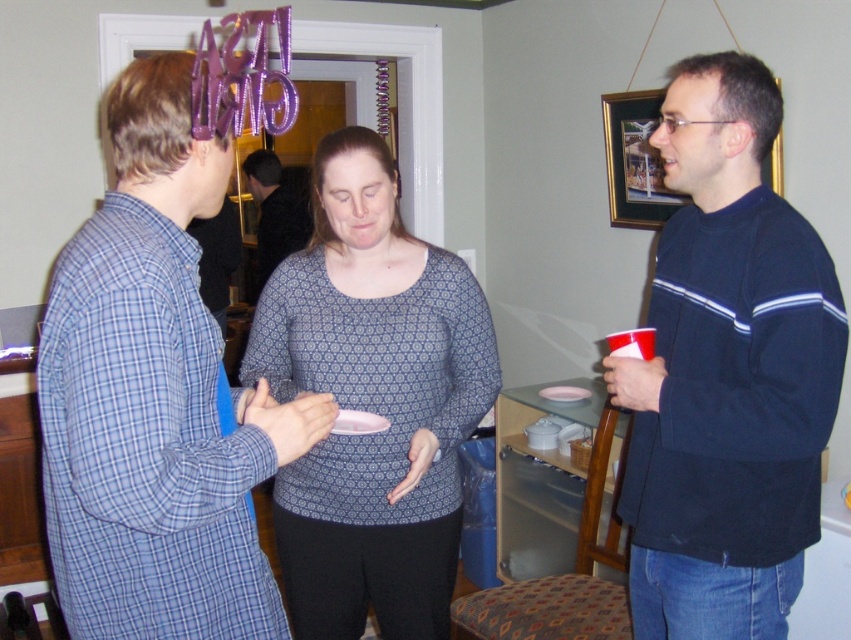
You are at a party and want to take a photo of two points in the room. The first point is at coordinates point (126, 515) and the second is at point (690, 609). Which point will appear larger in your camera view?

Point (126, 515) is closer to the camera than point (690, 609), so it will appear larger in the camera view.

You are trying to decide which clothing item to choose for a casual evening. You see the blue plaid pajama at left and the dark blue sweater at right. Which one is wider?

The blue plaid pajama at left is wider than the dark blue sweater at right.